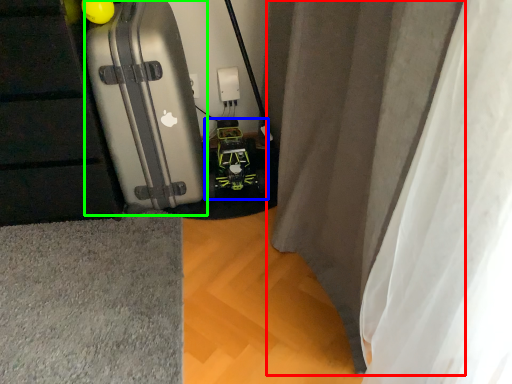
Question: Estimate the real-world distances between objects in this image. Which object is farther from curtain (highlighted by a red box), toy car (highlighted by a blue box) or suitcase (highlighted by a green box)?

Choices:
 (A) toy car
 (B) suitcase

Answer: (A)